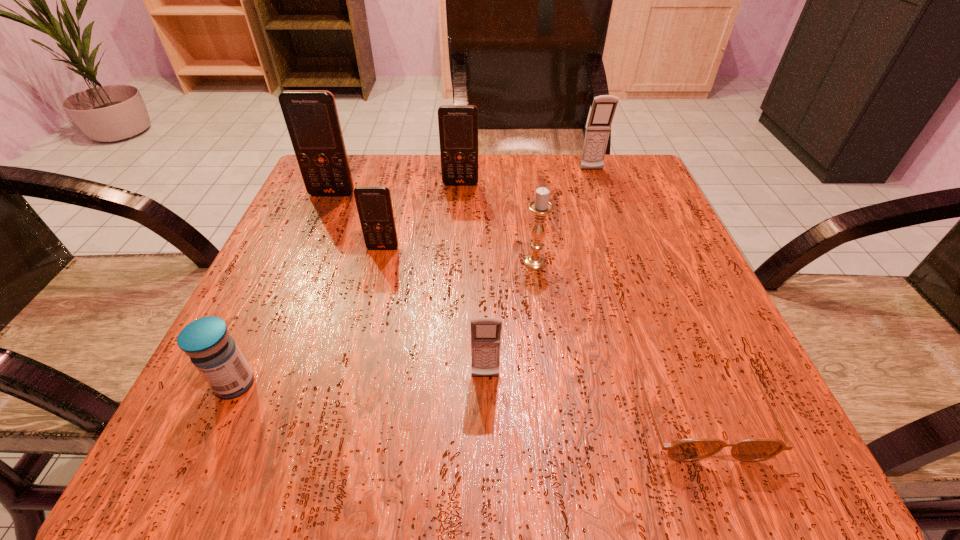
The width and height of the screenshot is (960, 540). Identify the location of the leftmost cellular telephone. (311, 117).

Where is `the leftmost orange cellular telephone`? the leftmost orange cellular telephone is located at coordinates (311, 117).

Where is `the farther gray cellular telephone`? The image size is (960, 540). the farther gray cellular telephone is located at coordinates (603, 108).

Identify the location of the right gray cellular telephone. This screenshot has height=540, width=960. (603, 108).

Locate an element on the screen. Image resolution: width=960 pixels, height=540 pixels. the second biggest orange cellular telephone is located at coordinates (458, 124).

Where is `the second farthest cellular telephone`? The height and width of the screenshot is (540, 960). the second farthest cellular telephone is located at coordinates (458, 124).

You are a GUI agent. You are given a task and a screenshot of the screen. Output one action in this format:
    pyautogui.click(x=<x>, y=<y>)
    Task: Click on the fifth farthest object
    
    Given the screenshot: What is the action you would take?
    pyautogui.click(x=540, y=207)

Find the location of a particular element. Image resolution: width=960 pixels, height=540 pixels. the third object from right to left is located at coordinates (540, 207).

This screenshot has height=540, width=960. I want to click on the second nearest cellular telephone, so click(x=374, y=204).

Locate an element on the screen. Image resolution: width=960 pixels, height=540 pixels. the smallest orange cellular telephone is located at coordinates (374, 204).